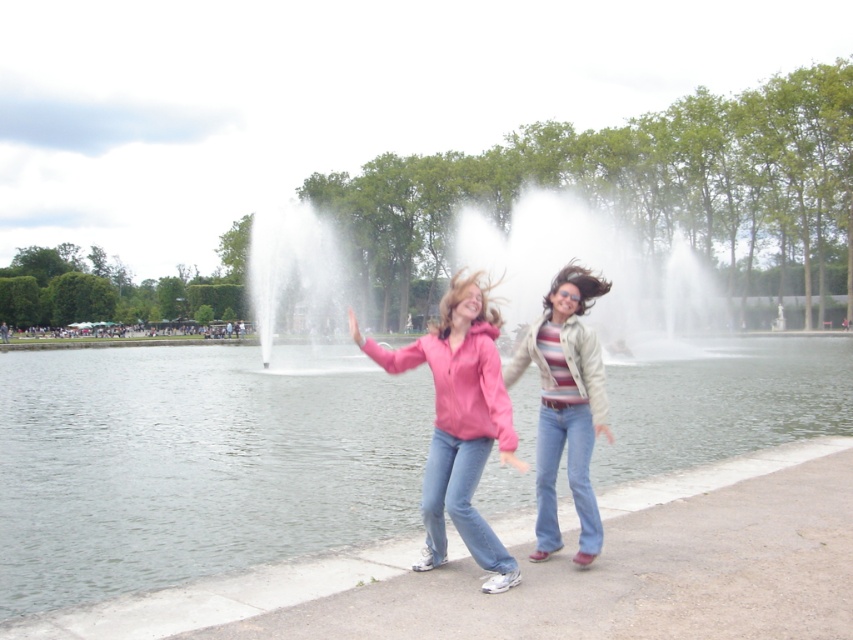
You are standing at the point marked by the coordinates point [194,464] in the image. What is the closest object to you?

The point [194,464] marks clear water at center, so the closest object to you is the clear water at center.

You are a photographer aiming to capture a wide shot of the scene. The camera you are using has a maximum width capacity of 1.5 meters. Given the clear water at center and the pink matte jacket at center, can you fit both objects within the camera frame without cropping either of them?

The clear water at center is wider than the pink matte jacket at center. Since the camera can capture up to 1.5 meters, but the exact widths of the objects are not provided, it is uncertain if both will fit without cropping. However, if the combined width of both objects is less than or equal to 1.5 meters, they can be captured together.

You are a photographer trying to capture the two people in the scene. Since the clear water at center and the pink matte jacket at center are both in your viewfinder, which one should you focus on to ensure the subject is large enough in the photo?

The clear water at center is bigger than the pink matte jacket at center, so focusing on the clear water at center would ensure the subject appears larger in the photo.